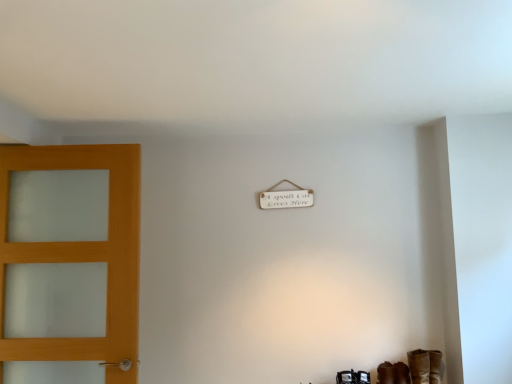
The image size is (512, 384). In order to click on brown leather shoe at lower right in this screenshot , I will do `click(346, 377)`.

How much distance is there between brown leather boot at lower right and brown leather shoe at lower right?

They are 31.80 centimeters apart.

In the scene shown: Is brown leather boot at lower right next to brown leather shoe at lower right and touching it?

No, brown leather boot at lower right is not next to brown leather shoe at lower right.

Which is in front, point (418, 360) or point (342, 373)?

Point (418, 360)

Based on the photo, is brown leather boot at lower right looking in the opposite direction of brown leather shoe at lower right?

brown leather boot at lower right does not have its back to brown leather shoe at lower right.

Is point (336, 376) closer or farther from the camera than point (429, 357)?

Clearly, point (336, 376) is more distant from the camera than point (429, 357).

Is brown leather shoe at lower right facing away from brown leather boot at lower right?

That's not correct — brown leather shoe at lower right is not looking away from brown leather boot at lower right.

From a real-world perspective, which is physically below, brown leather shoe at lower right or brown leather boot at lower right?

From a 3D spatial view, brown leather shoe at lower right is below.

Can you confirm if brown leather shoe at lower right is smaller than brown leather boot at lower right?

Correct, brown leather shoe at lower right occupies less space than brown leather boot at lower right.

Is brown leather boot at lower right looking in the opposite direction of matte wood door at left?

brown leather boot at lower right is not turned away from matte wood door at left.

Is there a large distance between brown leather boot at lower right and matte wood door at left?

Yes, brown leather boot at lower right and matte wood door at left are located far from each other.

In terms of width, does brown leather boot at lower right look wider or thinner when compared to matte wood door at left?

brown leather boot at lower right is wider than matte wood door at left.

Does matte wood door at left turn towards brown leather boot at lower right?

No, matte wood door at left is not facing towards brown leather boot at lower right.

Is the surface of matte wood door at left in direct contact with brown leather boot at lower right?

No, matte wood door at left is not in contact with brown leather boot at lower right.

From the picture: Between matte wood door at left and brown leather boot at lower right, which one has more height?

Standing taller between the two is matte wood door at left.

Is brown leather shoe at lower right closer to camera compared to matte wood door at left?

No.

Is brown leather shoe at lower right directly adjacent to matte wood door at left?

No, brown leather shoe at lower right is not beside matte wood door at left.

From the image's perspective, is brown leather shoe at lower right under matte wood door at left?

Yes, from the image's perspective, brown leather shoe at lower right is below matte wood door at left.

Would you say brown leather shoe at lower right is outside matte wood door at left?

A: brown leather shoe at lower right is positioned outside matte wood door at left.

Between matte wood door at left and brown leather shoe at lower right, which one has more height?

With more height is matte wood door at left.

In the scene shown: Is matte wood door at left with brown leather shoe at lower right?

There is a gap between matte wood door at left and brown leather shoe at lower right.

Considering the positions of points (128, 290) and (356, 379), is point (128, 290) closer to camera compared to point (356, 379)?

Yes, it is in front of point (356, 379).

Which is behind, matte wood door at left or brown leather shoe at lower right?

brown leather shoe at lower right is further away from the camera.

The width and height of the screenshot is (512, 384). I want to click on boot on the right side of brown leather shoe at lower right, so click(x=419, y=366).

You are a GUI agent. You are given a task and a screenshot of the screen. Output one action in this format:
    pyautogui.click(x=<x>, y=<y>)
    Task: Click on the shoe located below the brown leather boot at lower right (from the image's perspective)
    The width and height of the screenshot is (512, 384).
    Given the screenshot: What is the action you would take?
    pyautogui.click(x=346, y=377)

Looking at the image, which one is located closer to brown leather shoe at lower right, brown leather boot at lower right or matte wood door at left?

Based on the image, brown leather boot at lower right appears to be nearer to brown leather shoe at lower right.

Considering their positions, is brown leather shoe at lower right positioned closer to matte wood door at left than brown leather boot at lower right?

brown leather shoe at lower right.

Looking at the image, which one is located further to brown leather boot at lower right, matte wood door at left or brown leather shoe at lower right?

Among the two, matte wood door at left is located further to brown leather boot at lower right.

Looking at the image, which one is located closer to brown leather boot at lower right, brown leather shoe at lower right or matte wood door at left?

Among the two, brown leather shoe at lower right is located nearer to brown leather boot at lower right.

Estimate the real-world distances between objects in this image. Which object is further from brown leather shoe at lower right, matte wood door at left or brown leather boot at lower right?

matte wood door at left is further to brown leather shoe at lower right.

Looking at the image, which one is located further to matte wood door at left, brown leather boot at lower right or brown leather shoe at lower right?

brown leather boot at lower right is further to matte wood door at left.

Locate an element on the screen. The width and height of the screenshot is (512, 384). shoe between matte wood door at left and brown leather boot at lower right in the horizontal direction is located at coordinates (346, 377).